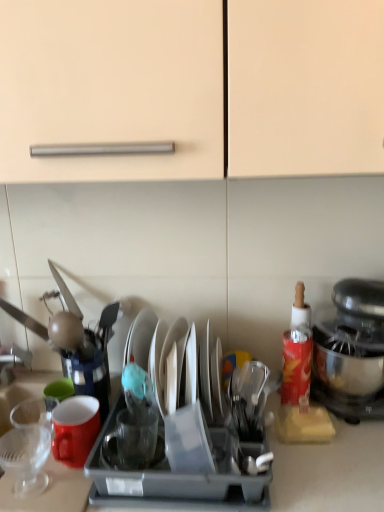
At what (x,y) coordinates should I click in order to perform the action: click on matte ceramic mug at left. Please return your answer as a coordinate pair (x, y). The width and height of the screenshot is (384, 512). Looking at the image, I should click on (75, 429).

Where is `transparent glass cup at left, marked as the third tableware in a right-to-left arrangement`? transparent glass cup at left, marked as the third tableware in a right-to-left arrangement is located at coordinates (26, 459).

Describe the element at coordinates (135, 438) in the screenshot. The height and width of the screenshot is (512, 384). I see `transparent glass cup at center, the 2th tableware viewed from the left` at that location.

At what (x,y) coordinates should I click in order to perform the action: click on red matte bottle at right. Please return your answer as a coordinate pair (x, y). This screenshot has width=384, height=512. Looking at the image, I should click on (297, 354).

Is point (128, 419) in front of point (288, 341)?

Yes, it is.

Is transparent glass cup at center, the 2th tableware viewed from the left, oriented towards red matte bottle at right?

No, transparent glass cup at center, the 2th tableware viewed from the left, does not turn towards red matte bottle at right.

From the image's perspective, would you say transparent glass cup at center, the 2th tableware viewed from the left, is positioned over red matte bottle at right?

Incorrect, from the image's perspective, transparent glass cup at center, the 2th tableware viewed from the left, is lower than red matte bottle at right.

Could red matte bottle at right be considered to be inside transparent glass cup at center, the 2th tableware viewed from the left?

No.

Where is `tableware that is above the transparent glass cup at center, the 2th tableware viewed from the left (from the image's perspective)`? tableware that is above the transparent glass cup at center, the 2th tableware viewed from the left (from the image's perspective) is located at coordinates (206, 371).

Is point (128, 461) positioned behind point (202, 371)?

No, (128, 461) is in front of (202, 371).

Considering the relative positions of transparent glass cup at center, the 2th tableware viewed from the left, and shiny silver plate at center, which appears as the 1th tableware when viewed from the right, in the image provided, is transparent glass cup at center, the 2th tableware viewed from the left, behind shiny silver plate at center, which appears as the 1th tableware when viewed from the right,?

No, transparent glass cup at center, the 2th tableware viewed from the left, is in front of shiny silver plate at center, which appears as the 1th tableware when viewed from the right.

Can you tell me how much transparent glass cup at center, marked as the second tableware in a right-to-left arrangement, and shiny silver plate at center, which is the third tableware from left to right, differ in facing direction?

→ transparent glass cup at center, marked as the second tableware in a right-to-left arrangement, and shiny silver plate at center, which is the third tableware from left to right, are facing 0.617 degrees away from each other.

In order to click on tableware below the matte ceramic mug at left (from the image's perspective) in this screenshot , I will do `click(26, 459)`.

Is transparent glass cup at left, marked as the third tableware in a right-to-left arrangement, looking in the opposite direction of matte ceramic mug at left?

That's not correct — transparent glass cup at left, marked as the third tableware in a right-to-left arrangement, is not looking away from matte ceramic mug at left.

Which is more to the right, transparent glass cup at left, marked as the third tableware in a right-to-left arrangement, or matte ceramic mug at left?

From the viewer's perspective, matte ceramic mug at left appears more on the right side.

Is matte ceramic mug at left taller than red matte bottle at right?

Incorrect, the height of matte ceramic mug at left is not larger of that of red matte bottle at right.

Is red matte bottle at right completely or partially inside matte ceramic mug at left?

No, red matte bottle at right is not inside matte ceramic mug at left.

Is matte ceramic mug at left thinner than red matte bottle at right?

No.

From the image's perspective, is matte ceramic mug at left above or below red matte bottle at right?

Clearly, from the image's perspective, matte ceramic mug at left is below red matte bottle at right.

Which is behind, point (207, 351) or point (61, 454)?

Point (207, 351)

From the picture: Can you see shiny silver plate at center, which appears as the 1th tableware when viewed from the right, touching matte ceramic mug at left?

shiny silver plate at center, which appears as the 1th tableware when viewed from the right, and matte ceramic mug at left are not in contact.

How distant is shiny silver plate at center, which is the third tableware from left to right, from matte ceramic mug at left?

shiny silver plate at center, which is the third tableware from left to right, is 10.67 inches away from matte ceramic mug at left.

Does shiny silver plate at center, which is the third tableware from left to right, come in front of matte ceramic mug at left?

No, shiny silver plate at center, which is the third tableware from left to right, is further to the viewer.

Is shiny silver plate at center, which appears as the 1th tableware when viewed from the right, in contact with transparent glass cup at center, marked as the second tableware in a right-to-left arrangement?

shiny silver plate at center, which appears as the 1th tableware when viewed from the right, is not next to transparent glass cup at center, marked as the second tableware in a right-to-left arrangement, and they're not touching.

Considering the sizes of objects shiny silver plate at center, which is the third tableware from left to right, and transparent glass cup at center, the 2th tableware viewed from the left, in the image provided, who is thinner, shiny silver plate at center, which is the third tableware from left to right, or transparent glass cup at center, the 2th tableware viewed from the left,?

transparent glass cup at center, the 2th tableware viewed from the left, is thinner.

Is transparent glass cup at center, the 2th tableware viewed from the left, at the back of shiny silver plate at center, which is the third tableware from left to right?

No.

Which object is positioned more to the right, shiny silver plate at center, which is the third tableware from left to right, or transparent glass cup at center, the 2th tableware viewed from the left?

From the viewer's perspective, shiny silver plate at center, which is the third tableware from left to right, appears more on the right side.

Considering the positions of objects metallic silver stand mixer at right and red matte bottle at right in the image provided, who is in front, metallic silver stand mixer at right or red matte bottle at right?

metallic silver stand mixer at right is more forward.

Measure the distance between metallic silver stand mixer at right and red matte bottle at right.

metallic silver stand mixer at right is 9.17 centimeters away from red matte bottle at right.

Is point (350, 320) positioned after point (303, 407)?

No, it is not.

Considering the positions of objects metallic silver stand mixer at right and red matte bottle at right in the image provided, who is more to the right, metallic silver stand mixer at right or red matte bottle at right?

From the viewer's perspective, metallic silver stand mixer at right appears more on the right side.

From a real-world perspective, count 2nd tablewares downward from the red matte bottle at right and point to it. Please provide its 2D coordinates.

[(135, 438)]

From the image's perspective, which tableware is the 1st one below the shiny silver plate at center, which appears as the 1th tableware when viewed from the right? Please provide its 2D coordinates.

[(135, 438)]

Which object lies nearer to the anchor point red matte bottle at right, metallic silver stand mixer at right or transparent glass cup at center, marked as the second tableware in a right-to-left arrangement?

metallic silver stand mixer at right lies closer to red matte bottle at right than the other object.

Based on their spatial positions, is shiny silver plate at center, which is the third tableware from left to right, or red matte bottle at right further from metallic silver stand mixer at right?

Based on the image, shiny silver plate at center, which is the third tableware from left to right, appears to be further to metallic silver stand mixer at right.

Based on their spatial positions, is matte ceramic mug at left or transparent glass cup at center, the 2th tableware viewed from the left, further from metallic silver stand mixer at right?

Among the two, matte ceramic mug at left is located further to metallic silver stand mixer at right.

Looking at the image, which one is located closer to transparent glass cup at left, marked as the third tableware in a right-to-left arrangement, red matte bottle at right or transparent glass cup at center, marked as the second tableware in a right-to-left arrangement?

The object closer to transparent glass cup at left, marked as the third tableware in a right-to-left arrangement, is transparent glass cup at center, marked as the second tableware in a right-to-left arrangement.

When comparing their distances from matte ceramic mug at left, does transparent glass cup at center, the 2th tableware viewed from the left, or shiny silver plate at center, which is the third tableware from left to right, seem further?

The object further to matte ceramic mug at left is shiny silver plate at center, which is the third tableware from left to right.

From the image, which object appears to be farther from red matte bottle at right, metallic silver stand mixer at right or transparent glass cup at left, placed as the 1th tableware when sorted from left to right?

Among the two, transparent glass cup at left, placed as the 1th tableware when sorted from left to right, is located further to red matte bottle at right.

Estimate the real-world distances between objects in this image. Which object is closer to matte ceramic mug at left, red matte bottle at right or shiny silver plate at center, which is the third tableware from left to right?

shiny silver plate at center, which is the third tableware from left to right.

Which object lies further to the anchor point shiny silver plate at center, which appears as the 1th tableware when viewed from the right, matte ceramic mug at left or red matte bottle at right?

matte ceramic mug at left is positioned further to the anchor shiny silver plate at center, which appears as the 1th tableware when viewed from the right.

Locate an element on the screen. The image size is (384, 512). coffee cup located between transparent glass cup at left, marked as the third tableware in a right-to-left arrangement, and transparent glass cup at center, marked as the second tableware in a right-to-left arrangement, in the left-right direction is located at coordinates [75, 429].

The width and height of the screenshot is (384, 512). I want to click on coffee cup between transparent glass cup at left, placed as the 1th tableware when sorted from left to right, and shiny silver plate at center, which is the third tableware from left to right, in the horizontal direction, so click(75, 429).

The image size is (384, 512). Find the location of `coffee cup between transparent glass cup at left, placed as the 1th tableware when sorted from left to right, and metallic silver stand mixer at right, in the horizontal direction`. coffee cup between transparent glass cup at left, placed as the 1th tableware when sorted from left to right, and metallic silver stand mixer at right, in the horizontal direction is located at coordinates (75, 429).

The height and width of the screenshot is (512, 384). In order to click on coffee cup situated between transparent glass cup at left, placed as the 1th tableware when sorted from left to right, and red matte bottle at right from left to right in this screenshot , I will do `click(75, 429)`.